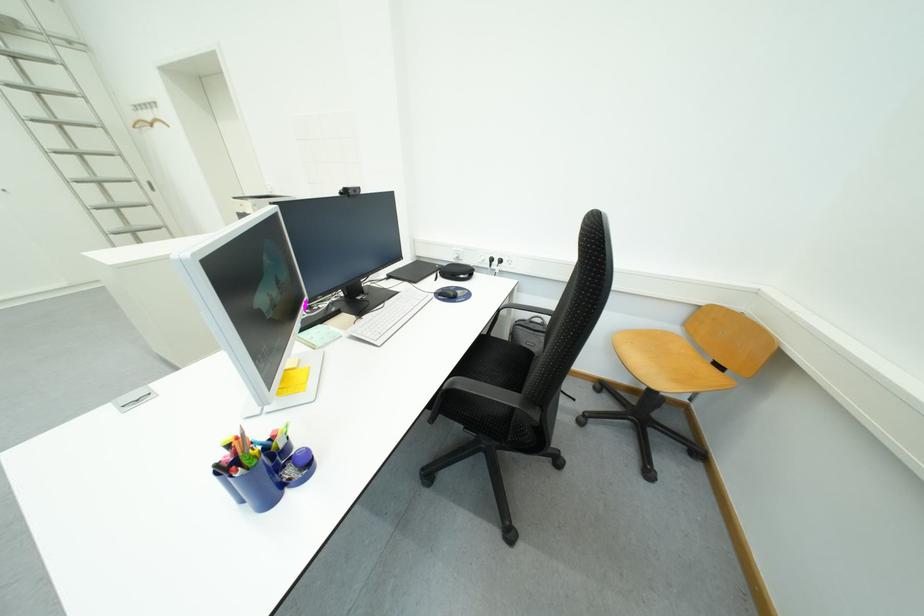
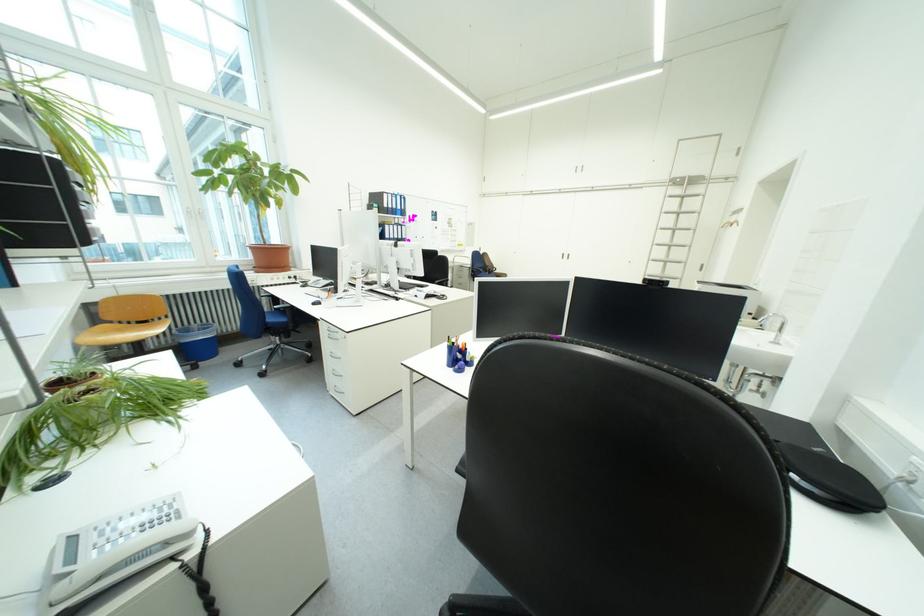
Consider the image. The images are taken continuously from a first-person perspective. In which direction is your viewpoint rotating?

The rotation direction of the camera is left-down.